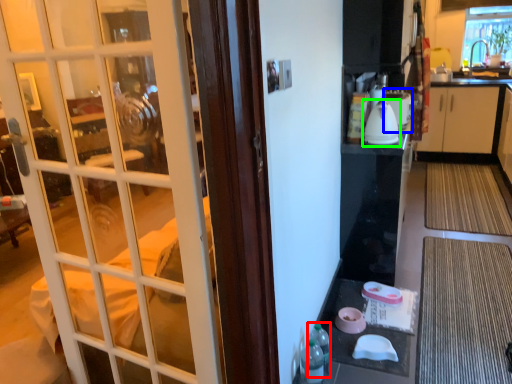
Question: Based on their relative distances, which object is farther from bottle (highlighted by a red box)? Choose from appliance (highlighted by a blue box) and kitchen appliance (highlighted by a green box).

Choices:
 (A) appliance
 (B) kitchen appliance

Answer: (A)